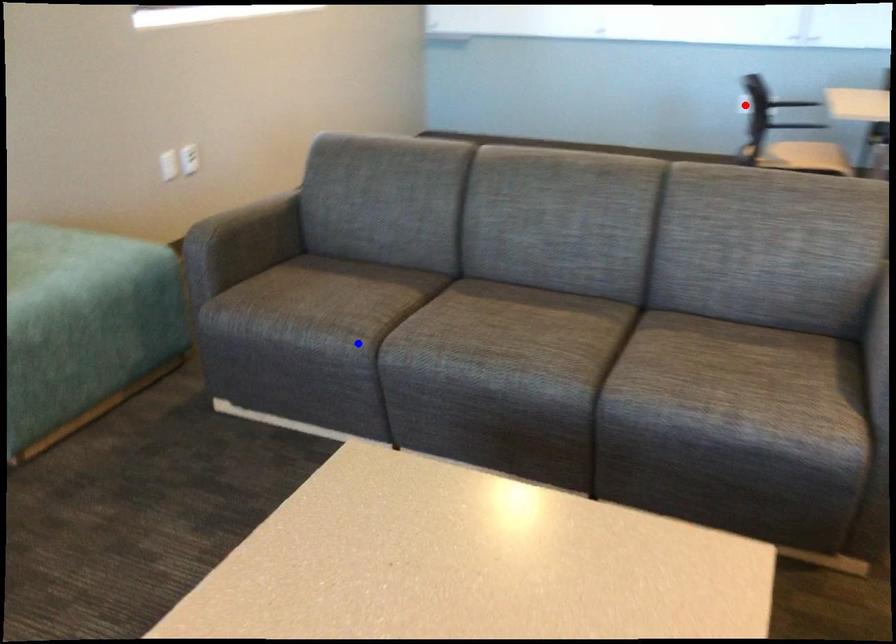
Question: In the image, two points are highlighted. Which point is nearer to the camera? Reply with the corresponding letter.

Choices:
 (A) blue point
 (B) red point

Answer: (A)